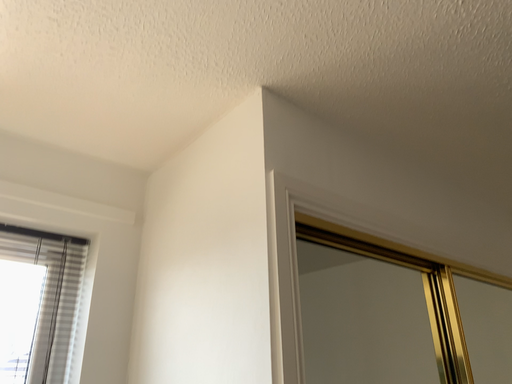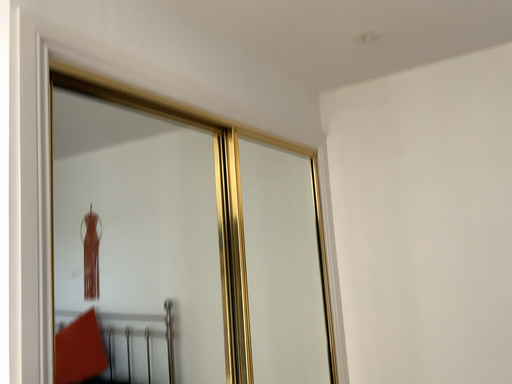
Question: Which way did the camera rotate in the video?

Choices:
 (A) rotated upward
 (B) rotated downward

Answer: (B)